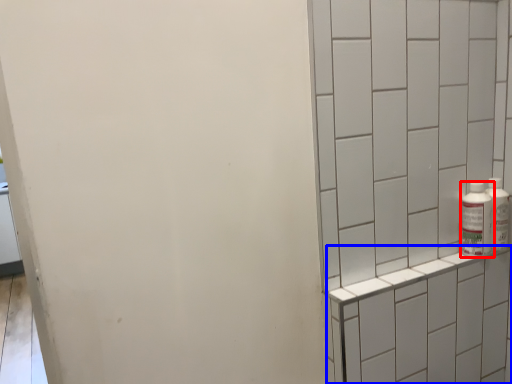
Question: Among these objects, which one is farthest to the camera, bottle (highlighted by a red box) or shelf (highlighted by a blue box)?

Choices:
 (A) bottle
 (B) shelf

Answer: (A)